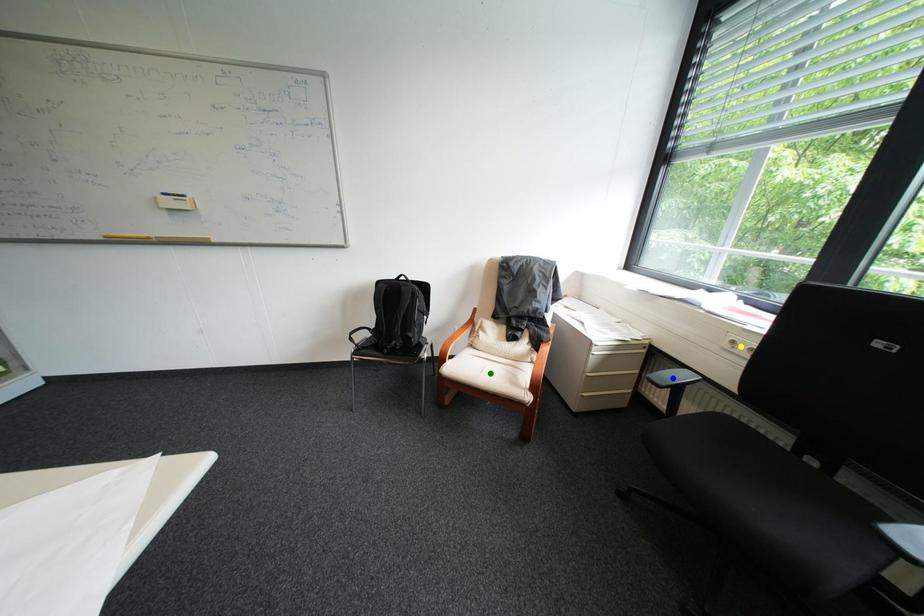
Order these from farthest to nearest:
- blue point
- yellow point
- green point

green point < blue point < yellow point